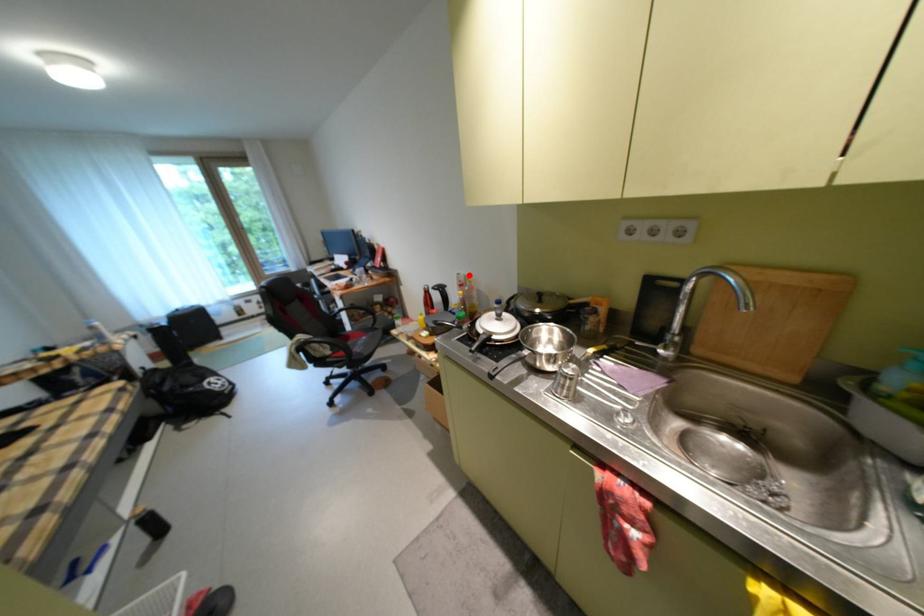
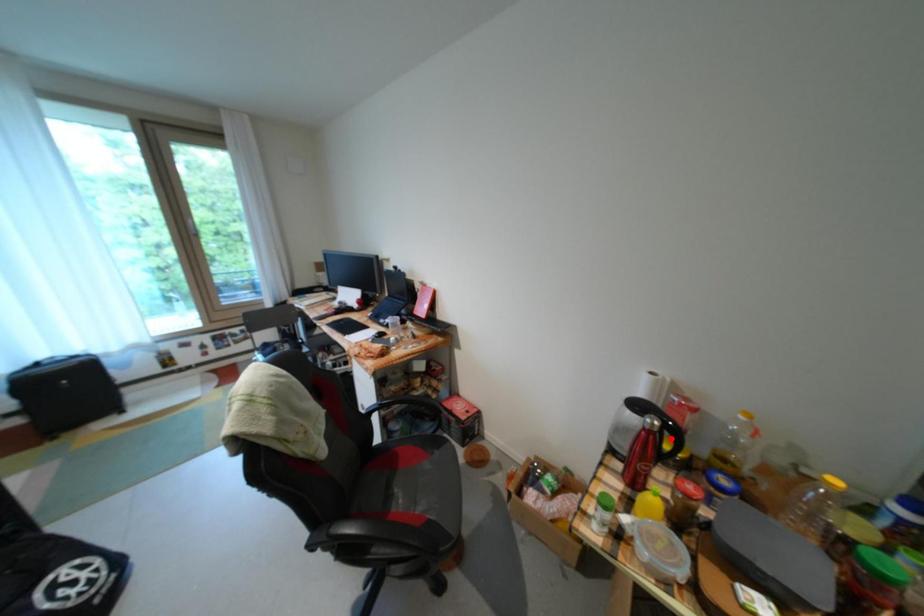
I am providing you with two images of the same scene from different viewpoints. A red point is marked on the first image and another point is marked on the second image. Are the points marked in image1 and image2 representing the same 3D position?

No